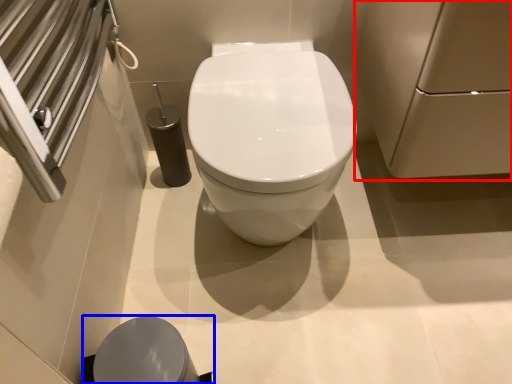
Question: Which object appears closest to the camera in this image, screen door (highlighted by a red box) or porcelain (highlighted by a blue box)?

Choices:
 (A) screen door
 (B) porcelain

Answer: (A)